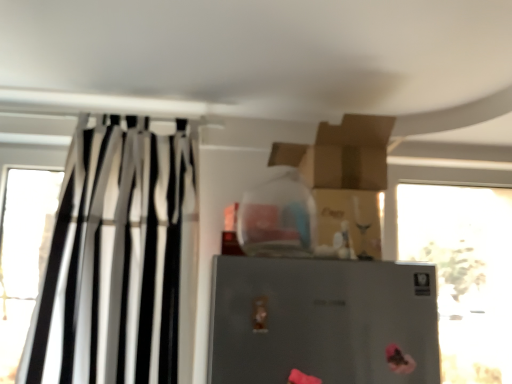
Question: From a real-world perspective, is transparent glass bottle at upper center positioned above or below black/white striped curtain at left?

Choices:
 (A) below
 (B) above

Answer: (B)

Question: Is point (266, 244) closer or farther from the camera than point (125, 380)?

Choices:
 (A) farther
 (B) closer

Answer: (B)

Question: Which object is the farthest from the transparent glass bottle at upper center?

Choices:
 (A) black/white striped curtain at left
 (B) transparent glass window at right
 (C) satin silver refrigerator at center

Answer: (B)

Question: Estimate the real-world distances between objects in this image. Which object is farther from the black/white striped curtain at left?

Choices:
 (A) transparent glass window at right
 (B) transparent glass bottle at upper center
 (C) satin silver refrigerator at center

Answer: (A)